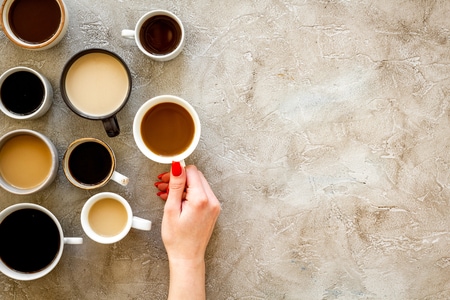
You are a GUI agent. You are given a task and a screenshot of the screen. Output one action in this format:
    pyautogui.click(x=<x>, y=<y>)
    Task: Click on the coffee cups
    
    Given the screenshot: What is the action you would take?
    [41, 27], [153, 34], [105, 82], [20, 95], [31, 165], [37, 230], [81, 156], [102, 218], [166, 117]